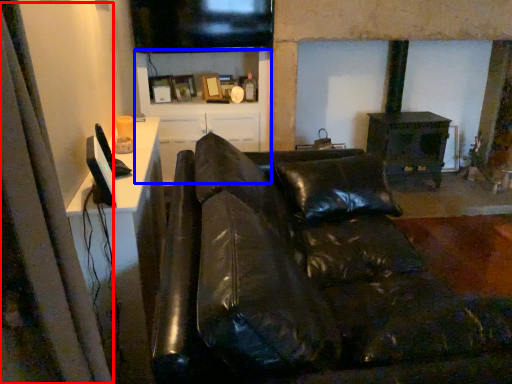
Question: Which of the following is the closest to the observer, curtain (highlighted by a red box) or tv cabinet (highlighted by a blue box)?

Choices:
 (A) curtain
 (B) tv cabinet

Answer: (A)